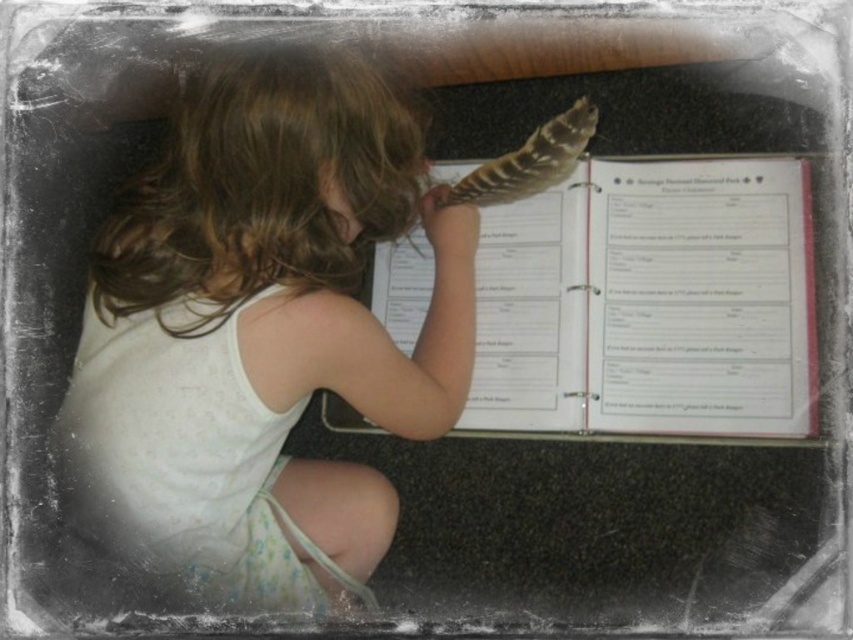
Who is lower down, white cotton shirt at center or brown feather at upper center?

white cotton shirt at center is below.

Find the location of `white cotton shirt at center`. white cotton shirt at center is located at coordinates (262, 332).